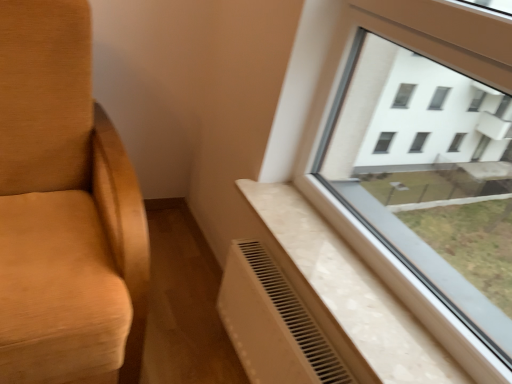
Find the location of a particular element. empty space that is ontop of white plastic radiator at lower center (from a real-world perspective) is located at coordinates (281, 286).